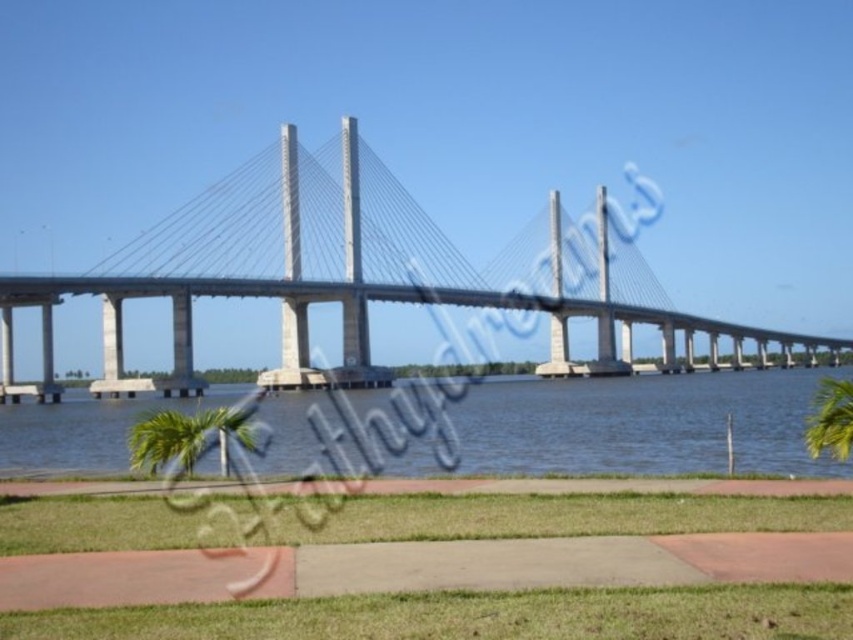
You are standing on the suspension bridge and see two points marked on the bridge. The first point is at coordinates point (180, 380) and the second is at point (827, 451). From your perspective on the bridge, which point is closer to you?

Point (180, 380) is behind point (827, 451), so the closer point to you is point (827, 451).

Where is the concrete bridge at center located in the image?

The concrete bridge at center is located at point [343,276].

Consider the image. You are standing on the walkway and want to take a photo of the concrete bridge at center and the green leafy palm tree at lower right. Which object should you point your camera upwards to capture?

You should point your camera upwards to capture the concrete bridge at center because it is above the green leafy palm tree at lower right.